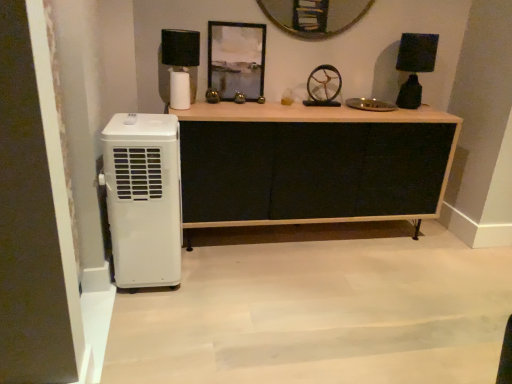
Locate an element on the screen. The height and width of the screenshot is (384, 512). free space behind metallic gold wheel at center is located at coordinates (322, 103).